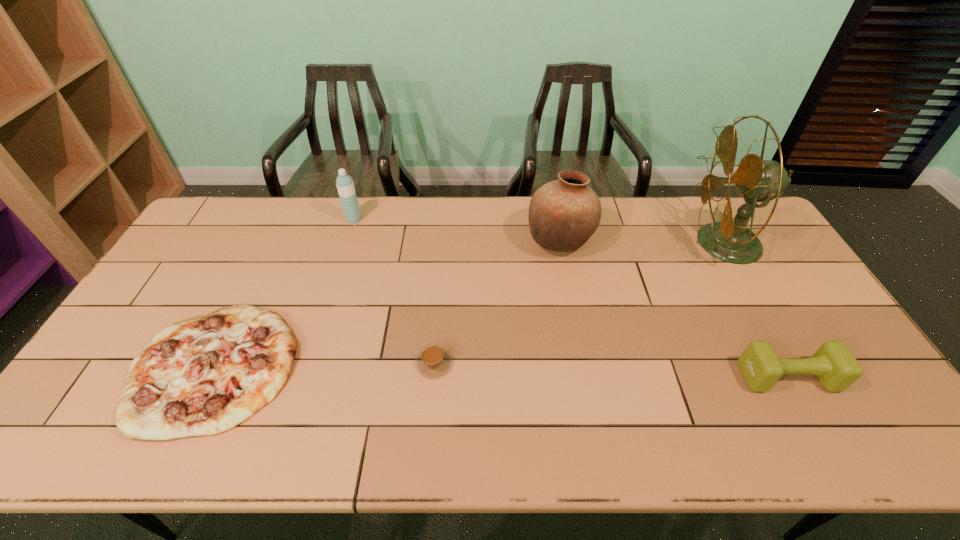
Where is `empty location between the leftmost object and the tallest object`? empty location between the leftmost object and the tallest object is located at coordinates (469, 305).

You are a GUI agent. You are given a task and a screenshot of the screen. Output one action in this format:
    pyautogui.click(x=<x>, y=<y>)
    Task: Click on the free space between the pottery and the fourth tallest object
    
    Given the screenshot: What is the action you would take?
    pyautogui.click(x=674, y=309)

At what (x,y) coordinates should I click in order to perform the action: click on empty location between the second object from left to right and the cappuccino. Please return your answer as a coordinate pair (x, y). This screenshot has height=540, width=960. Looking at the image, I should click on (394, 292).

I want to click on unoccupied position between the fourth object from left to right and the tallest object, so click(x=643, y=242).

Where is `free spot between the fourth object from left to right and the pizza`? The width and height of the screenshot is (960, 540). free spot between the fourth object from left to right and the pizza is located at coordinates (387, 304).

The width and height of the screenshot is (960, 540). I want to click on unoccupied position between the fourth object from left to right and the pizza, so click(x=387, y=304).

Where is `free space between the fifth shortest object and the tallest object`? This screenshot has height=540, width=960. free space between the fifth shortest object and the tallest object is located at coordinates (643, 242).

At what (x,y) coordinates should I click in order to perform the action: click on vacant space that is in between the pizza and the tallest object. Please return your answer as a coordinate pair (x, y). The image size is (960, 540). Looking at the image, I should click on (469, 305).

Locate an element on the screen. The width and height of the screenshot is (960, 540). unoccupied position between the water bottle and the pizza is located at coordinates (284, 293).

Identify which object is located as the third nearest to the cappuccino. Please provide its 2D coordinates. Your answer should be formatted as a tuple, i.e. [(x, y)], where the tuple contains the x and y coordinates of a point satisfying the conditions above.

[(345, 186)]